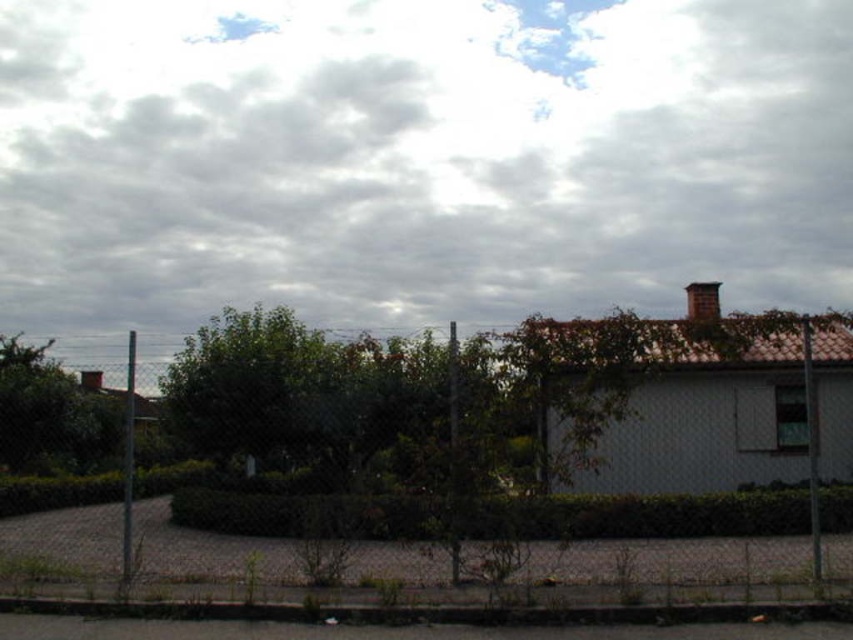
You are standing in the residential area shown in the image. If you look directly upward, will you see the cloudy sky at upper center?

Yes, the cloudy sky at upper center is located at point (x=415, y=161), which corresponds to the upper center position in the image. Looking directly upward from the scene would align with this position.

You are standing in the residential area and want to take a photo of both the point at coordinates point (103, 250) and point (161, 484). Since you want both points to be in focus, you need to adjust your camera so that the focal point is equidistant from both points. Where should you place the focal point?

The focal point should be placed halfway between point (103, 250) and point (161, 484). Since point (103, 250) is closer to the camera than point (161, 484), the midpoint between them will ensure both are in focus.